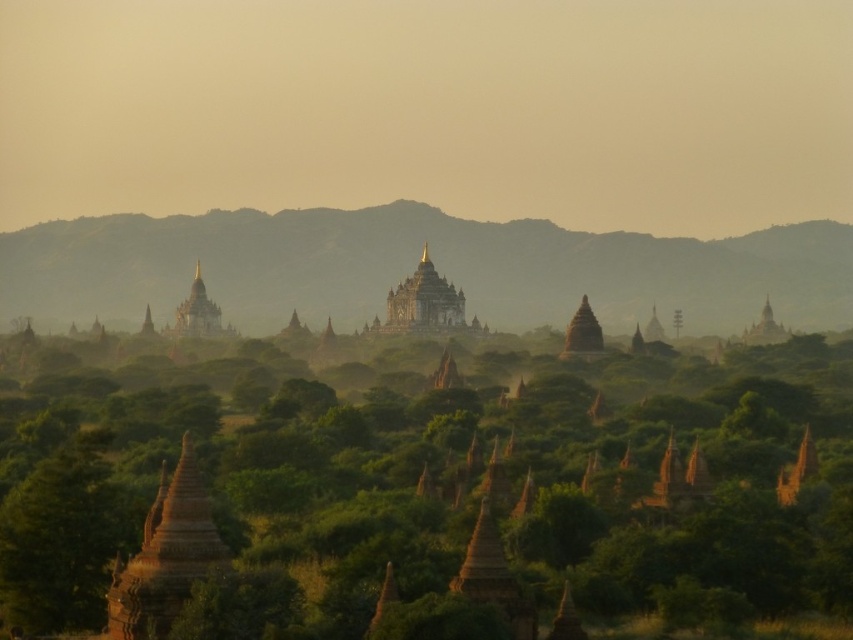
Does brown textured stupa at center have a larger size compared to gold/golden stupa at center?

Correct, brown textured stupa at center is larger in size than gold/golden stupa at center.

Is brown textured stupa at center thinner than gold/golden stupa at center?

In fact, brown textured stupa at center might be wider than gold/golden stupa at center.

Measure the distance between point (0, 509) and camera.

They are 152.88 meters apart.

At what (x,y) coordinates should I click in order to perform the action: click on brown textured stupa at center. Please return your answer as a coordinate pair (x, y). Image resolution: width=853 pixels, height=640 pixels. Looking at the image, I should click on (419, 490).

Does golden stone temple at center come behind gold/golden stupa at center?

That is False.

Which is behind, point (450, 312) or point (206, 301)?

The point (206, 301) is behind.

In order to click on golden stone temple at center in this screenshot , I will do `click(424, 305)`.

Does brown textured stupa at center have a greater width compared to golden stone temple at center?

Correct, the width of brown textured stupa at center exceeds that of golden stone temple at center.

Can you confirm if brown textured stupa at center is bigger than golden stone temple at center?

Yes.

In order to click on brown textured stupa at center in this screenshot , I will do `click(419, 490)`.